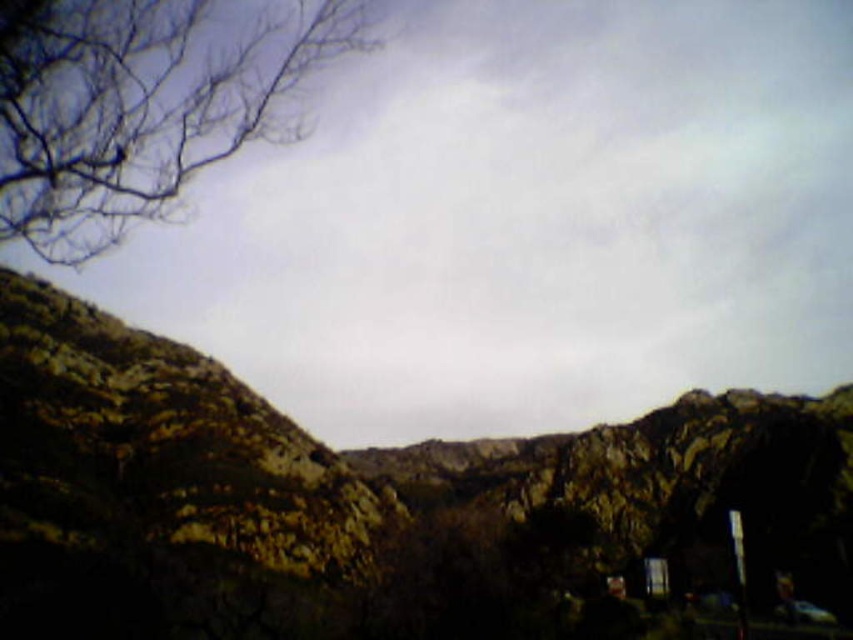
Question: Which object is closer to the camera taking this photo?

Choices:
 (A) rugged stone mountain at center
 (B) brown/dry branches at upper left
 (C) brown rough rock at center

Answer: (B)

Question: Which of the following is the farthest from the observer?

Choices:
 (A) (109, 81)
 (B) (369, 541)

Answer: (B)

Question: Is rugged stone mountain at center closer to the viewer compared to brown rough rock at center?

Choices:
 (A) yes
 (B) no

Answer: (A)

Question: Does rugged stone mountain at center come in front of brown/dry branches at upper left?

Choices:
 (A) yes
 (B) no

Answer: (B)

Question: Can you confirm if rugged stone mountain at center is wider than brown rough rock at center?

Choices:
 (A) no
 (B) yes

Answer: (B)

Question: Which of the following is the farthest from the observer?

Choices:
 (A) (270, 492)
 (B) (45, 260)
 (C) (682, 412)

Answer: (C)